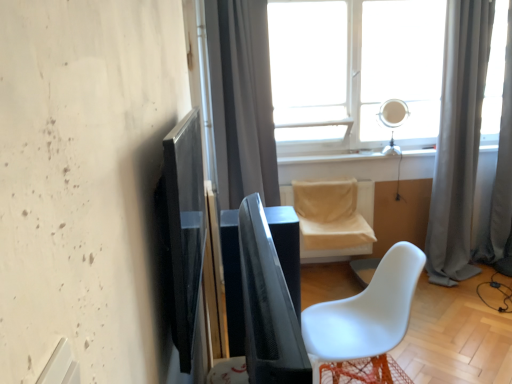
Question: Should I look upward or downward to see black glossy screen door at left?

Choices:
 (A) up
 (B) down

Answer: (B)

Question: Is white matte chair at lower right, the second chair positioned from the back, oriented towards gray fabric curtain at upper center, arranged as the first curtain when viewed from the left?

Choices:
 (A) no
 (B) yes

Answer: (A)

Question: Does white matte chair at lower right, the second chair positioned from the back, appear on the right side of gray fabric curtain at upper center, arranged as the first curtain when viewed from the left?

Choices:
 (A) no
 (B) yes

Answer: (B)

Question: Would you say white matte chair at lower right, which ranks as the first chair in front-to-back order, contains gray fabric curtain at upper center, which ranks as the 3th curtain in right-to-left order?

Choices:
 (A) no
 (B) yes

Answer: (A)

Question: Does white matte chair at lower right, the second chair positioned from the back, touch gray fabric curtain at upper center, arranged as the first curtain when viewed from the left?

Choices:
 (A) no
 (B) yes

Answer: (A)

Question: Considering the relative sizes of white matte chair at lower right, the second chair positioned from the back, and gray fabric curtain at upper center, arranged as the first curtain when viewed from the left, in the image provided, is white matte chair at lower right, the second chair positioned from the back, shorter than gray fabric curtain at upper center, arranged as the first curtain when viewed from the left,?

Choices:
 (A) yes
 (B) no

Answer: (A)

Question: From the image's perspective, is white matte chair at lower right, the second chair positioned from the back, below gray fabric curtain at upper center, which ranks as the 3th curtain in right-to-left order?

Choices:
 (A) no
 (B) yes

Answer: (B)

Question: Can you confirm if black glossy screen door at left is shorter than white matte chair at lower right, the second chair positioned from the back?

Choices:
 (A) no
 (B) yes

Answer: (B)

Question: Considering the relative positions of black glossy screen door at left and white matte chair at lower right, which ranks as the first chair in front-to-back order, in the image provided, is black glossy screen door at left in front of white matte chair at lower right, which ranks as the first chair in front-to-back order,?

Choices:
 (A) yes
 (B) no

Answer: (A)

Question: Does black glossy screen door at left have a smaller size compared to white matte chair at lower right, which ranks as the first chair in front-to-back order?

Choices:
 (A) no
 (B) yes

Answer: (B)

Question: From a real-world perspective, does black glossy screen door at left sit lower than white matte chair at lower right, which ranks as the first chair in front-to-back order?

Choices:
 (A) no
 (B) yes

Answer: (A)

Question: Is black glossy screen door at left oriented away from white matte chair at lower right, the second chair positioned from the back?

Choices:
 (A) yes
 (B) no

Answer: (B)

Question: Is black glossy screen door at left behind white matte chair at lower right, which ranks as the first chair in front-to-back order?

Choices:
 (A) no
 (B) yes

Answer: (A)

Question: Can you confirm if gray fabric curtain at right, which is the 2th curtain from right to left, is bigger than gray fabric curtain at upper center, which ranks as the 3th curtain in right-to-left order?

Choices:
 (A) yes
 (B) no

Answer: (A)